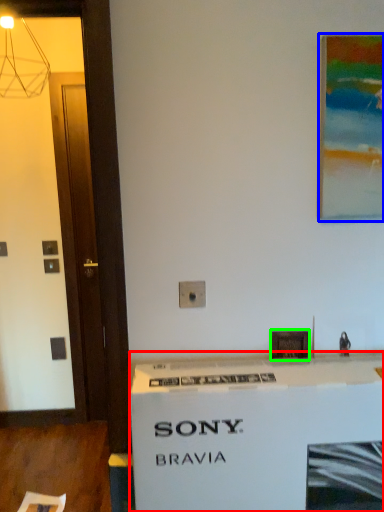
Question: Based on their relative distances, which object is farther from counter (highlighted by a red box)? Choose from picture frame (highlighted by a blue box) and picture frame (highlighted by a green box).

Choices:
 (A) picture frame
 (B) picture frame

Answer: (A)